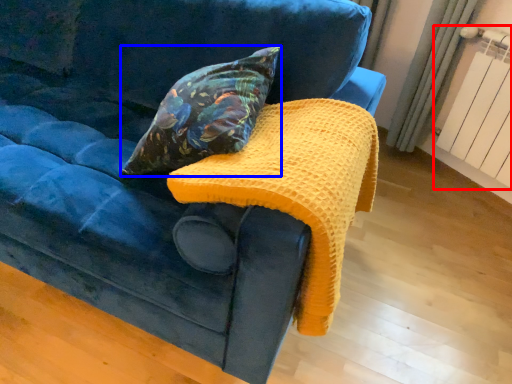
Question: Which object is closer to the camera taking this photo, radiator (highlighted by a red box) or pillow (highlighted by a blue box)?

Choices:
 (A) radiator
 (B) pillow

Answer: (B)